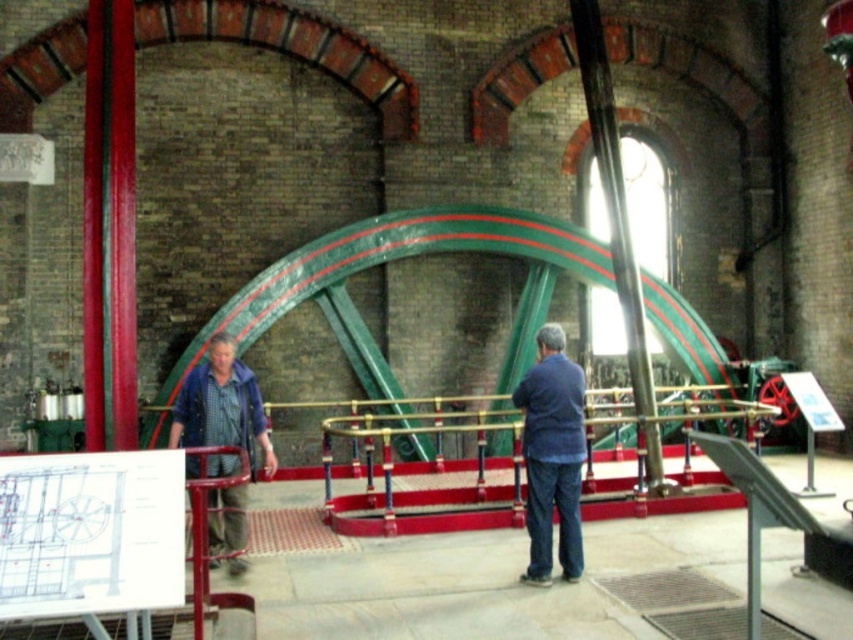
You are standing in the historic industrial building and see the blue denim jacket at center and the denim jacket at left. Which jacket is closer to you?

Answer: The blue denim jacket at center is closer to you because the denim jacket at left is behind it.

You are a visitor in this historic industrial building and want to touch the blue denim jacket at center. Can you reach it without going around the polished brass railing at center?

The blue denim jacket at center is behind the polished brass railing at center, so you cannot reach it without going around the polished brass railing at center.

You are standing in the historic industrial building depicted in the image. There is a point marked at coordinates point (566, 406). If you want to place a 10 meter long steel beam from your current position to that point, will it fit without extending beyond the point?

The distance between you and point (566, 406) is 8.63 meters. Since the steel beam is 10 meters long, it will extend 1.37 meters beyond the point.